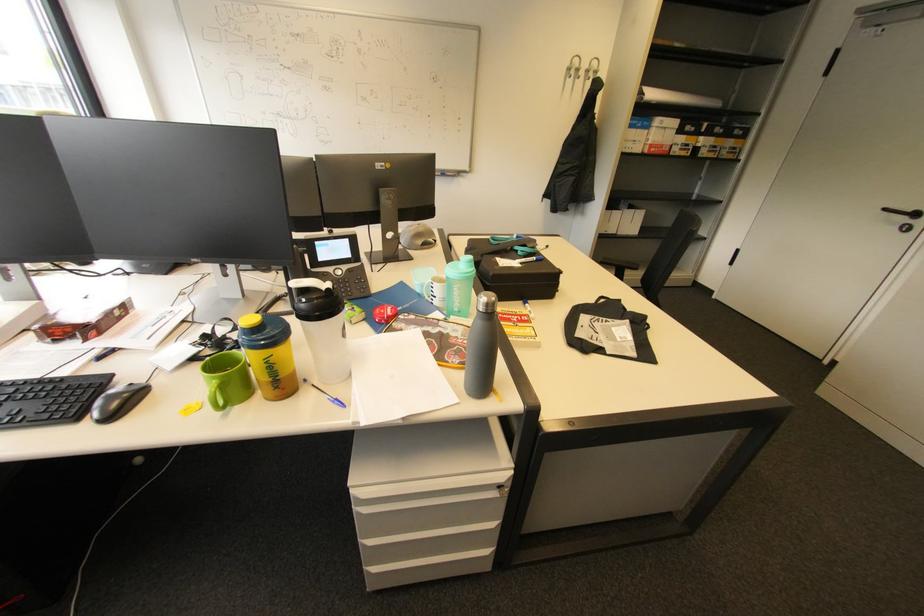
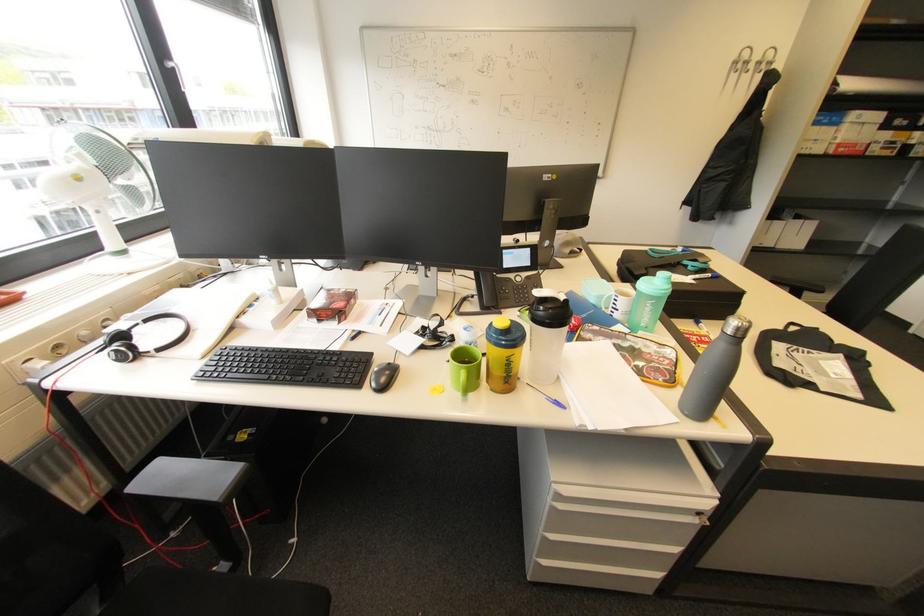
Locate, in the second image, the point that corresponds to pixel 219 379 in the first image.

(468, 369)